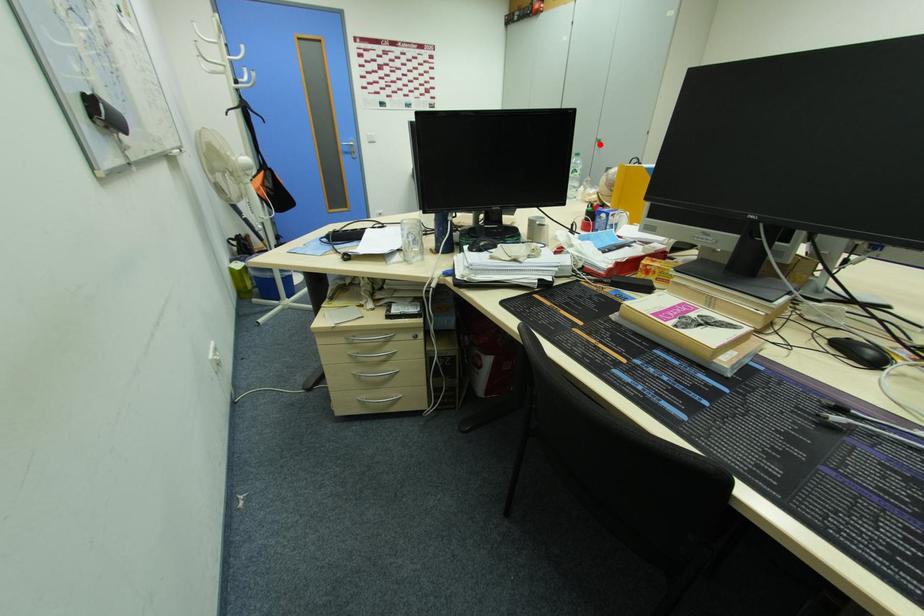
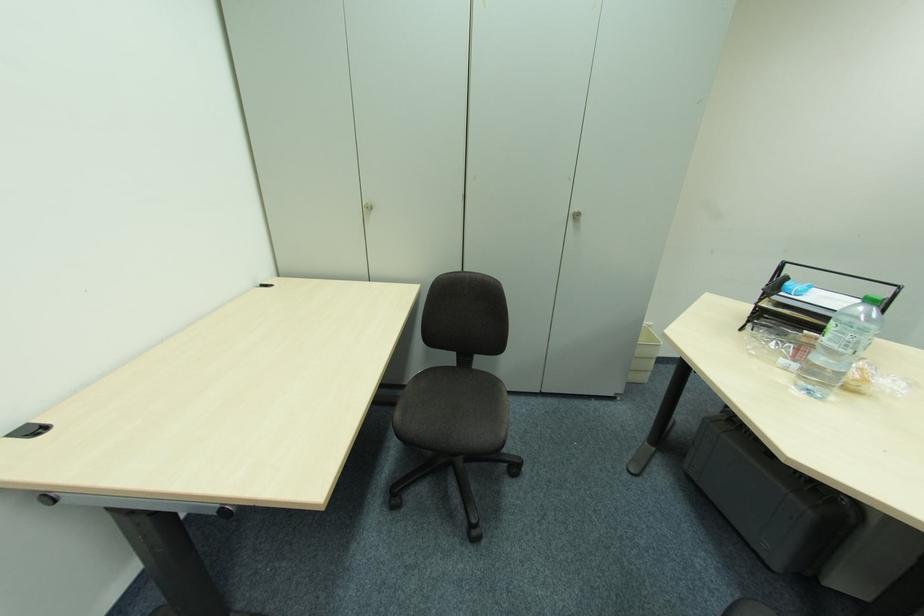
Find the pixel in the second image that matches the highlighted location in the first image.

(574, 219)